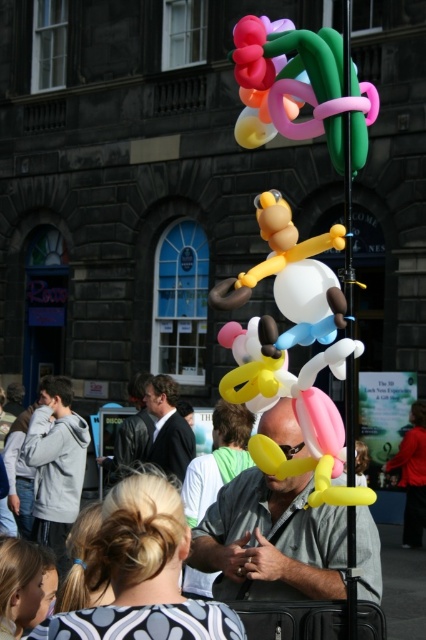
Is light gray hoodie at left to the right of dark gray suit at center from the viewer's perspective?

Incorrect, light gray hoodie at left is not on the right side of dark gray suit at center.

Does light gray hoodie at left appear over dark gray suit at center?

Incorrect, light gray hoodie at left is not positioned above dark gray suit at center.

Locate an element on the screen. light gray hoodie at left is located at coordinates (55, 465).

Is glossy balloon sculpture at upper center to the right of dark gray suit at center from the viewer's perspective?

Indeed, glossy balloon sculpture at upper center is positioned on the right side of dark gray suit at center.

Can you confirm if glossy balloon sculpture at upper center is positioned to the left of dark gray suit at center?

Incorrect, glossy balloon sculpture at upper center is not on the left side of dark gray suit at center.

Does point (259, 36) come closer to viewer compared to point (154, 456)?

Yes, point (259, 36) is in front of point (154, 456).

Locate an element on the screen. The image size is (426, 640). glossy balloon sculpture at upper center is located at coordinates (298, 88).

Is glossy balloon sculpture at upper center further to the viewer compared to light gray hoodie at left?

No, it is in front of light gray hoodie at left.

Does glossy balloon sculpture at upper center have a larger size compared to light gray hoodie at left?

Indeed, glossy balloon sculpture at upper center has a larger size compared to light gray hoodie at left.

This screenshot has width=426, height=640. In order to click on glossy balloon sculpture at upper center in this screenshot , I will do `click(298, 88)`.